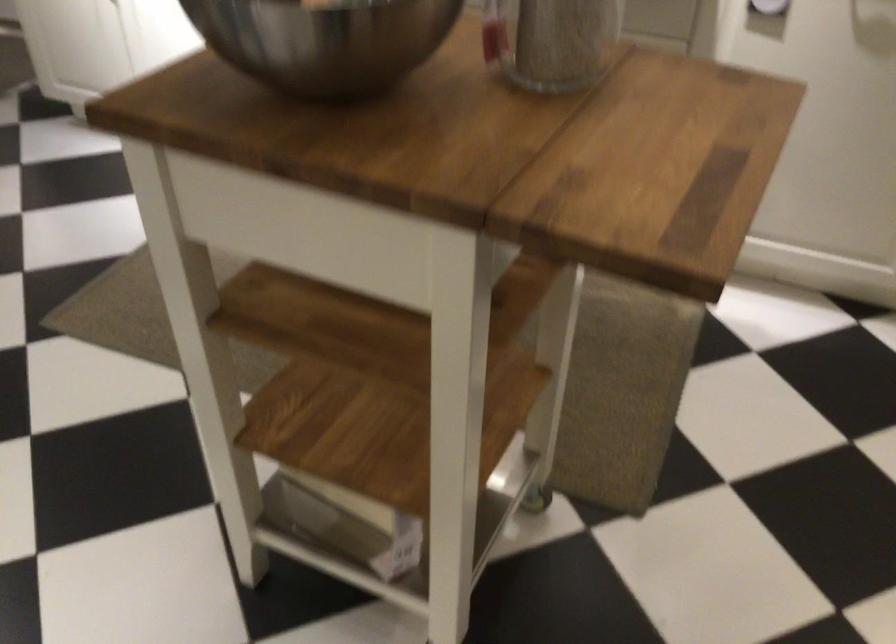
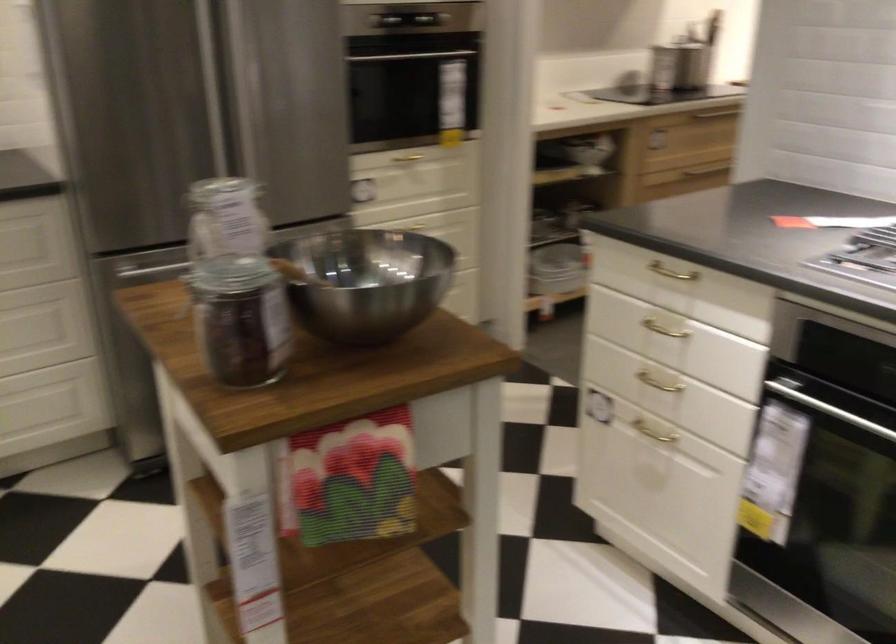
Question: I am providing you with two images of the same scene from different viewpoints. After the viewpoint changes to image2, which objects are now occluded?

Choices:
 (A) metal mixing bowl
 (B) glass jar
 (C) black handrail
 (D) cabinet handle

Answer: (B)